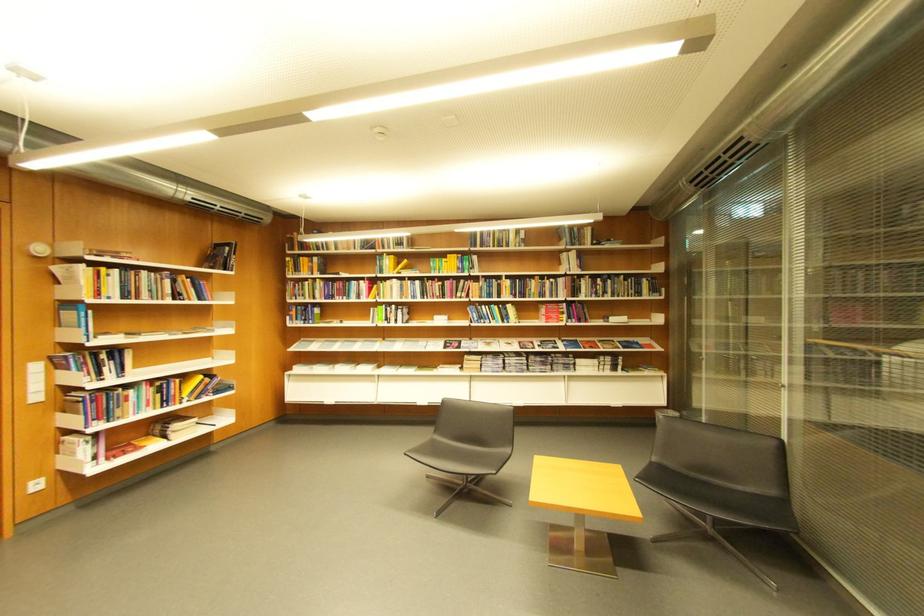
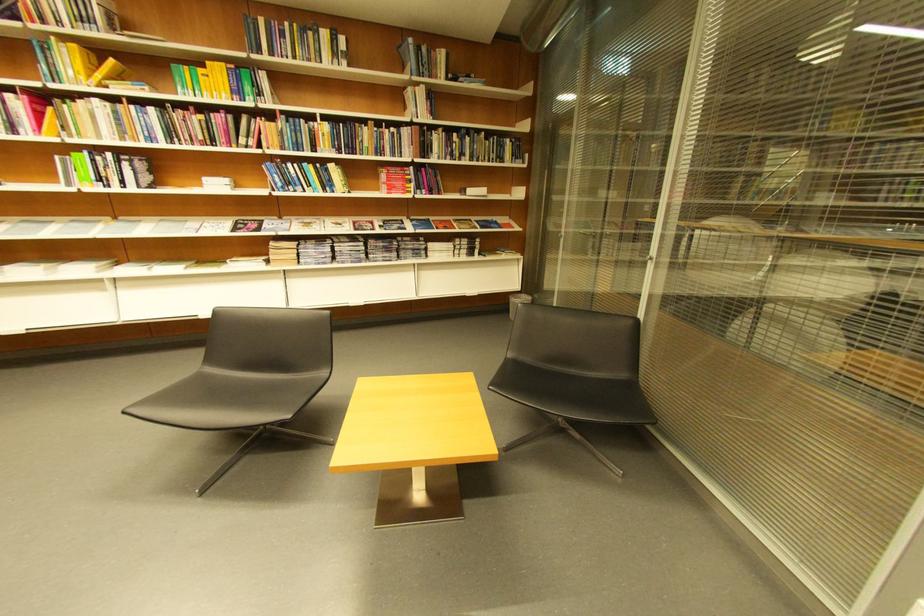
Where in the second image is the point corresponding to point 470,299 from the first image?

(258, 148)